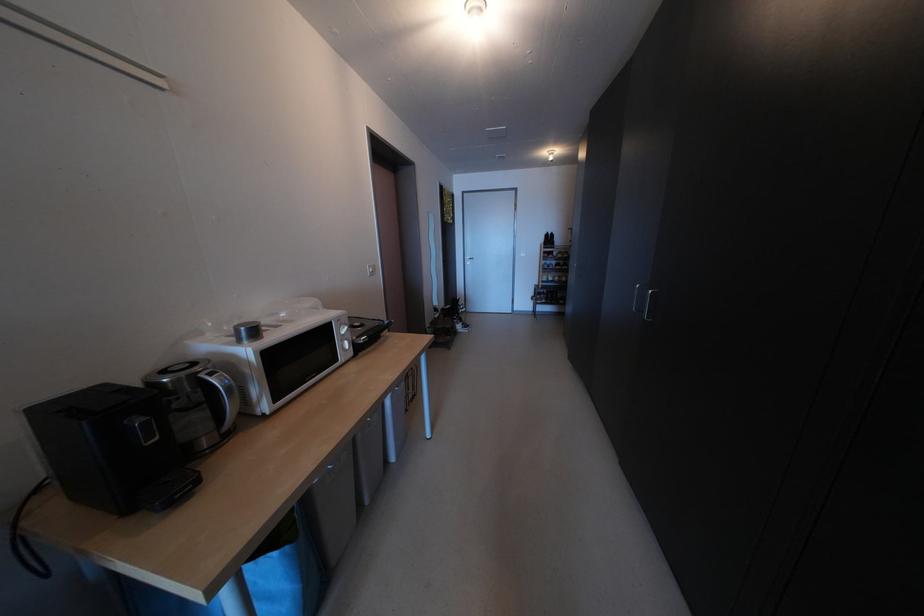
Describe the element at coordinates (168, 488) in the screenshot. The width and height of the screenshot is (924, 616). I see `the black coffee machine tray` at that location.